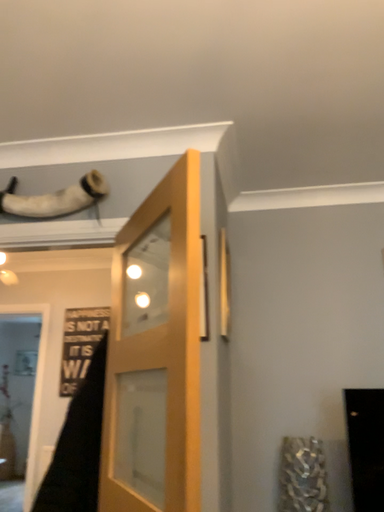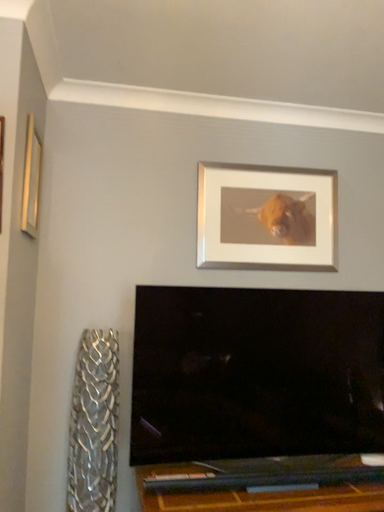
Question: Which way did the camera rotate in the video?

Choices:
 (A) rotated right
 (B) rotated left

Answer: (A)